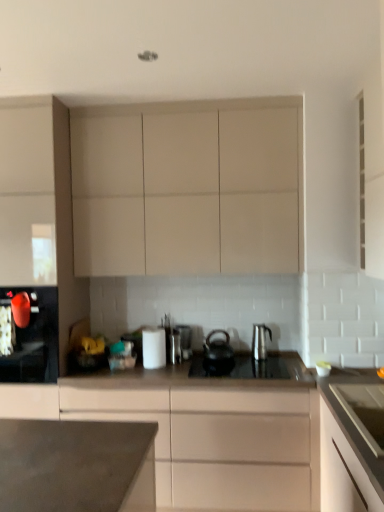
Question: Does black matte tea pot at center have a smaller size compared to matte white cabinet at left, the 1th cabinetry from the left?

Choices:
 (A) yes
 (B) no

Answer: (A)

Question: From the image's perspective, is black matte tea pot at center under matte white cabinet at left, which is counted as the 4th cabinetry, starting from the right?

Choices:
 (A) no
 (B) yes

Answer: (B)

Question: From the image's perspective, is black matte tea pot at center above matte white cabinet at left, which is counted as the 4th cabinetry, starting from the right?

Choices:
 (A) yes
 (B) no

Answer: (B)

Question: From a real-world perspective, does black matte tea pot at center stand above matte white cabinet at left, which is counted as the 4th cabinetry, starting from the right?

Choices:
 (A) no
 (B) yes

Answer: (A)

Question: Is black matte tea pot at center at the left side of matte white cabinet at left, which is counted as the 4th cabinetry, starting from the right?

Choices:
 (A) yes
 (B) no

Answer: (B)

Question: Does black matte tea pot at center appear on the right side of matte white cabinet at left, which is counted as the 4th cabinetry, starting from the right?

Choices:
 (A) yes
 (B) no

Answer: (A)

Question: Does satin silver kettle at center, the 3th kitchen appliance in the left-to-right sequence, touch satin silver toaster at center?

Choices:
 (A) yes
 (B) no

Answer: (B)

Question: Is satin silver kettle at center, marked as the 1th kitchen appliance in a right-to-left arrangement, not inside satin silver toaster at center?

Choices:
 (A) yes
 (B) no

Answer: (A)

Question: Can you confirm if satin silver kettle at center, marked as the 1th kitchen appliance in a right-to-left arrangement, is shorter than satin silver toaster at center?

Choices:
 (A) no
 (B) yes

Answer: (A)

Question: From a real-world perspective, is satin silver kettle at center, marked as the 1th kitchen appliance in a right-to-left arrangement, positioned over satin silver toaster at center based on gravity?

Choices:
 (A) yes
 (B) no

Answer: (A)

Question: Is satin silver kettle at center, marked as the 1th kitchen appliance in a right-to-left arrangement, surrounding satin silver toaster at center?

Choices:
 (A) yes
 (B) no

Answer: (B)

Question: Considering the relative sizes of satin silver kettle at center, marked as the 1th kitchen appliance in a right-to-left arrangement, and satin silver toaster at center in the image provided, is satin silver kettle at center, marked as the 1th kitchen appliance in a right-to-left arrangement, smaller than satin silver toaster at center?

Choices:
 (A) no
 (B) yes

Answer: (B)

Question: Does matte white cabinet at left, the 1th cabinetry from the left, have a lesser width compared to satin silver kettle at center, marked as the 1th kitchen appliance in a right-to-left arrangement?

Choices:
 (A) yes
 (B) no

Answer: (B)